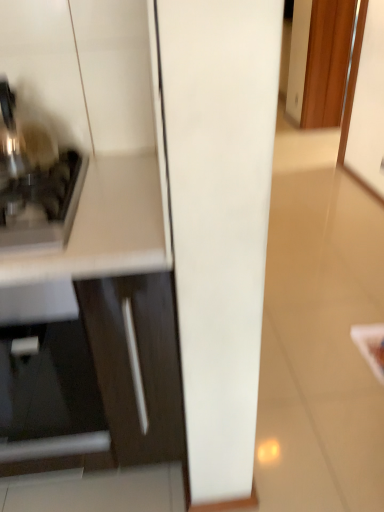
Question: Looking at their shapes, would you say matte white cabinet at left is wider or thinner than satin silver toaster at left?

Choices:
 (A) wide
 (B) thin

Answer: (A)

Question: Visually, is matte white cabinet at left positioned to the left or to the right of satin silver toaster at left?

Choices:
 (A) right
 (B) left

Answer: (B)

Question: Based on their sizes in the image, would you say matte white cabinet at left is bigger or smaller than satin silver toaster at left?

Choices:
 (A) big
 (B) small

Answer: (A)

Question: Looking at their shapes, would you say satin silver toaster at left is wider or thinner than matte white cabinet at left?

Choices:
 (A) wide
 (B) thin

Answer: (B)

Question: From the image's perspective, relative to matte white cabinet at left, is satin silver toaster at left above or below?

Choices:
 (A) below
 (B) above

Answer: (B)

Question: In terms of height, does satin silver toaster at left look taller or shorter compared to matte white cabinet at left?

Choices:
 (A) short
 (B) tall

Answer: (A)

Question: Considering their positions, is satin silver toaster at left located in front of or behind matte white cabinet at left?

Choices:
 (A) front
 (B) behind

Answer: (B)